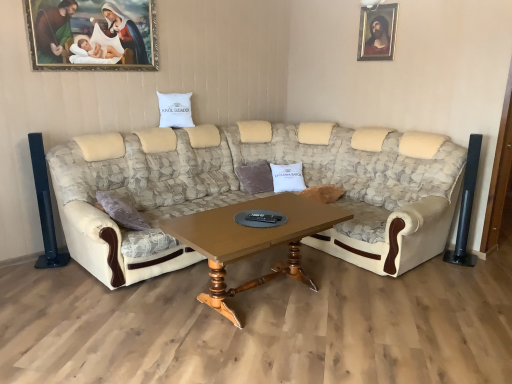
Question: Considering the relative sizes of wooden framed portrait at upper right, which appears as the first picture frame when viewed from the right, and wooden framed painting at upper left, the second picture frame when ordered from right to left, in the image provided, is wooden framed portrait at upper right, which appears as the first picture frame when viewed from the right, bigger than wooden framed painting at upper left, the second picture frame when ordered from right to left,?

Choices:
 (A) yes
 (B) no

Answer: (B)

Question: Can you confirm if wooden framed portrait at upper right, the 2th picture frame viewed from the front, is wider than wooden framed painting at upper left, the 1th picture frame when ordered from left to right?

Choices:
 (A) no
 (B) yes

Answer: (B)

Question: Does wooden framed portrait at upper right, marked as the 2th picture frame in a left-to-right arrangement, have a smaller size compared to wooden framed painting at upper left, which is the 2th picture frame in back-to-front order?

Choices:
 (A) no
 (B) yes

Answer: (B)

Question: From a real-world perspective, is wooden framed portrait at upper right, the 2th picture frame viewed from the front, on top of wooden framed painting at upper left, which is the 2th picture frame in back-to-front order?

Choices:
 (A) no
 (B) yes

Answer: (B)

Question: Is wooden framed portrait at upper right, which appears as the first picture frame when viewed from the right, not near wooden framed painting at upper left, which is the 2th picture frame in back-to-front order?

Choices:
 (A) yes
 (B) no

Answer: (A)

Question: From their relative heights in the image, would you say wooden polished table at center is taller or shorter than beige fabric couch at center?

Choices:
 (A) short
 (B) tall

Answer: (A)

Question: Looking at the image, does wooden polished table at center seem bigger or smaller compared to beige fabric couch at center?

Choices:
 (A) small
 (B) big

Answer: (A)

Question: Considering the relative positions of wooden polished table at center and beige fabric couch at center in the image provided, is wooden polished table at center to the left or to the right of beige fabric couch at center?

Choices:
 (A) right
 (B) left

Answer: (B)

Question: Is wooden polished table at center wider or thinner than beige fabric couch at center?

Choices:
 (A) wide
 (B) thin

Answer: (B)

Question: Is wooden framed portrait at upper right, which appears as the first picture frame when viewed from the right, taller or shorter than beige fabric couch at center?

Choices:
 (A) tall
 (B) short

Answer: (B)

Question: Considering their positions, is wooden framed portrait at upper right, marked as the 2th picture frame in a left-to-right arrangement, located in front of or behind beige fabric couch at center?

Choices:
 (A) front
 (B) behind

Answer: (B)

Question: From a real-world perspective, is wooden framed portrait at upper right, the 2th picture frame viewed from the front, above or below beige fabric couch at center?

Choices:
 (A) above
 (B) below

Answer: (A)

Question: Would you say wooden framed portrait at upper right, the 2th picture frame viewed from the front, is to the left or to the right of beige fabric couch at center in the picture?

Choices:
 (A) right
 (B) left

Answer: (A)

Question: Based on their positions, is beige fabric couch at center located to the left or right of wooden framed painting at upper left, which is the 2th picture frame in back-to-front order?

Choices:
 (A) left
 (B) right

Answer: (B)

Question: Is beige fabric couch at center wider or thinner than wooden framed painting at upper left, the 1th picture frame when ordered from left to right?

Choices:
 (A) wide
 (B) thin

Answer: (A)